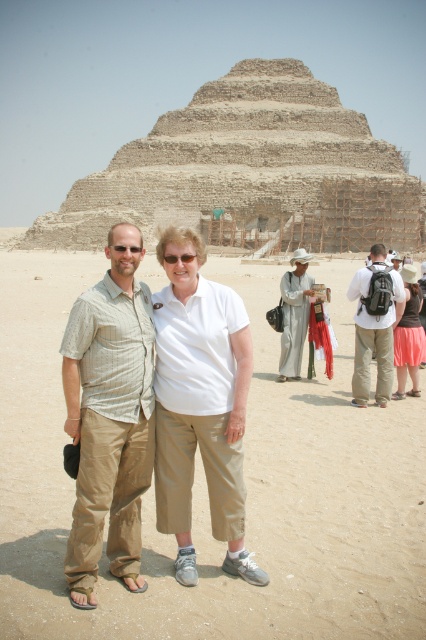
Question: Which is farther from the beige stone pyramid at center?

Choices:
 (A) light beige linen shirt at center
 (B) matte black backpack at center
 (C) pink fabric skirt at lower right
 (D) white cotton dress at center

Answer: (A)

Question: Does light beige linen shirt at center have a greater width compared to white cotton dress at center?

Choices:
 (A) yes
 (B) no

Answer: (A)

Question: Is beige stone pyramid at center above pink fabric skirt at lower right?

Choices:
 (A) yes
 (B) no

Answer: (A)

Question: Estimate the real-world distances between objects in this image. Which object is farther from the pink fabric skirt at lower right?

Choices:
 (A) light beige linen shirt at center
 (B) beige stone pyramid at center
 (C) matte black backpack at center

Answer: (B)

Question: Which point appears farthest from the camera in this image?

Choices:
 (A) (414, 372)
 (B) (391, 330)

Answer: (A)

Question: From the image, what is the correct spatial relationship of light beige linen shirt at center in relation to pink fabric skirt at lower right?

Choices:
 (A) left
 (B) right

Answer: (A)